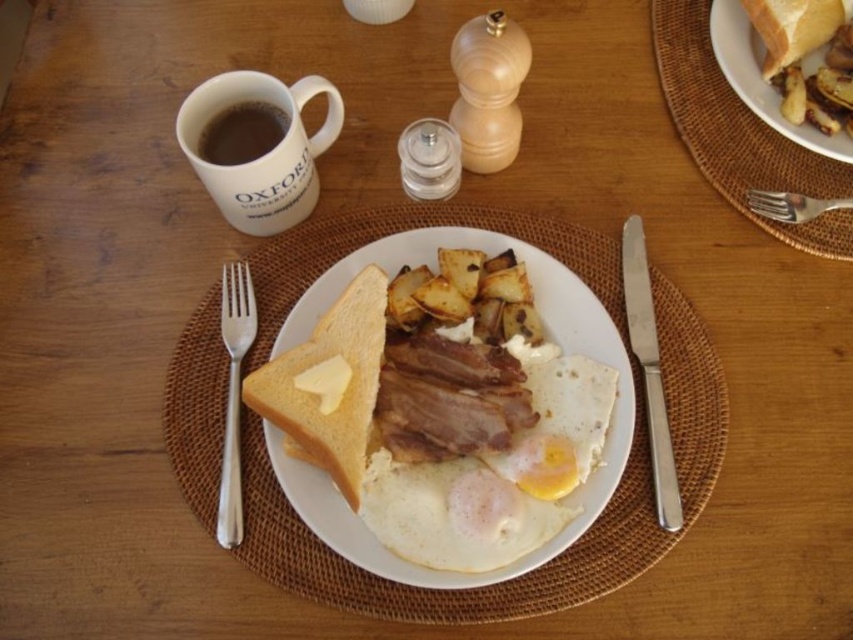
Question: Can you confirm if satin silver knife at right is bigger than white ceramic plate at upper right?

Choices:
 (A) no
 (B) yes

Answer: (A)

Question: Which point appears farthest from the camera in this image?

Choices:
 (A) (643, 268)
 (B) (267, 148)
 (C) (828, 205)

Answer: (C)

Question: Which object appears closest to the camera in this image?

Choices:
 (A) smooth white egg at center
 (B) dark matte mug at upper left
 (C) white matte toast at upper right

Answer: (A)

Question: Is white ceramic mug at upper left to the left of dark matte mug at upper left from the viewer's perspective?

Choices:
 (A) yes
 (B) no

Answer: (B)

Question: Which of the following is the farthest from the observer?

Choices:
 (A) (566, 298)
 (B) (279, 381)
 (C) (438, 394)

Answer: (A)

Question: Observing the image, what is the correct spatial positioning of butter-toasted bread at center-left in reference to white ceramic mug at upper left?

Choices:
 (A) right
 (B) left

Answer: (A)